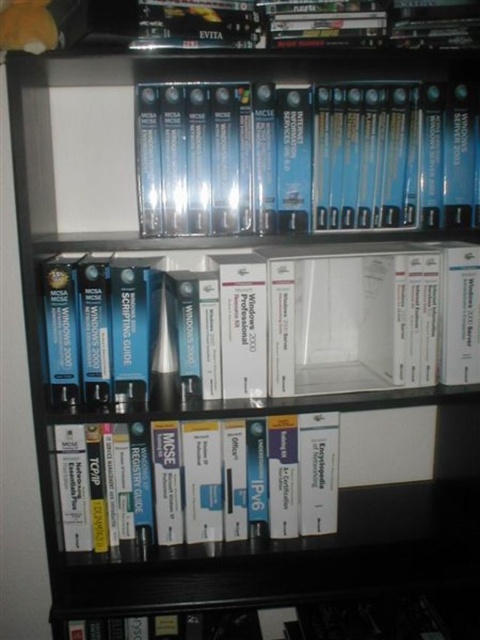
Question: Can you confirm if hardcover book at upper center is thinner than hardcover book at lower center?

Choices:
 (A) no
 (B) yes

Answer: (B)

Question: Considering the real-world distances, which object is closest to the hardcover book at lower center?

Choices:
 (A) blue matte book at upper center
 (B) blue matte book at center

Answer: (B)

Question: Among these objects, which one is farthest from the camera?

Choices:
 (A) hardcover book at upper center
 (B) orange plush toy at upper left

Answer: (B)

Question: Which object is farther from the camera taking this photo?

Choices:
 (A) orange plush toy at upper left
 (B) blue matte book at center
 (C) blue matte book at upper center
 (D) hardcover book at lower center

Answer: (D)

Question: Can you confirm if blue matte book at upper center is bigger than orange plush toy at upper left?

Choices:
 (A) no
 (B) yes

Answer: (B)

Question: Does blue matte book at center have a larger size compared to hardcover book at upper center?

Choices:
 (A) no
 (B) yes

Answer: (B)